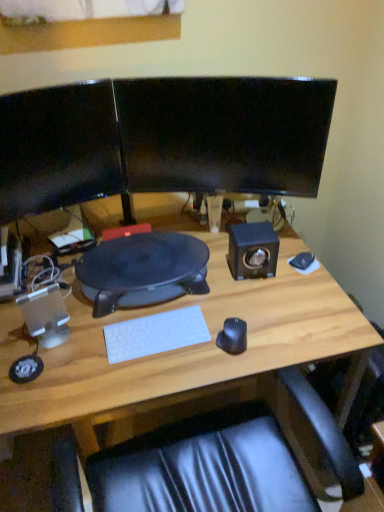
Question: From the image's perspective, is white plastic speaker at left, the second speaker viewed from the right, located above or below matte black monitor at left, acting as the 1th computer monitor starting from the left?

Choices:
 (A) above
 (B) below

Answer: (B)

Question: From a real-world perspective, relative to matte black monitor at left, which is the second computer monitor from right to left, is white plastic speaker at left, placed as the second speaker when sorted from back to front, vertically above or below?

Choices:
 (A) above
 (B) below

Answer: (B)

Question: Considering the real-world distances, which object is farthest from the black rubberized desk at center?

Choices:
 (A) white plastic speaker at left, arranged as the 1th speaker when viewed from the front
 (B) matte black monitor at left, which is the second computer monitor from right to left
 (C) wooden desk at center
 (D) matte black speaker at right, positioned as the 2th speaker in front-to-back order
 (E) white matte keyboard at center

Answer: (B)

Question: Estimate the real-world distances between objects in this image. Which object is farther from the black matte mouse at center?

Choices:
 (A) white plastic speaker at left, the second speaker viewed from the right
 (B) wooden desk at center
 (C) matte black monitor at left, acting as the 1th computer monitor starting from the left
 (D) matte black speaker at right, placed as the 1th speaker when sorted from right to left
 (E) white matte mousepad at right

Answer: (C)